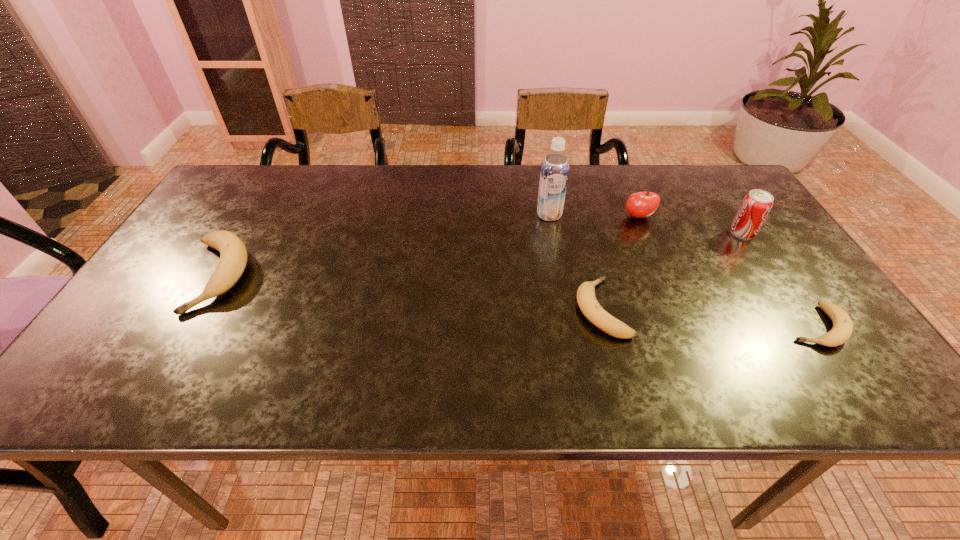
Please point a location where one more banana can be added evenly. Please provide its 2D coordinates. Your answer should be formatted as a tuple, i.e. [(x, y)], where the tuple contains the x and y coordinates of a point satisfying the conditions above.

[(402, 291)]